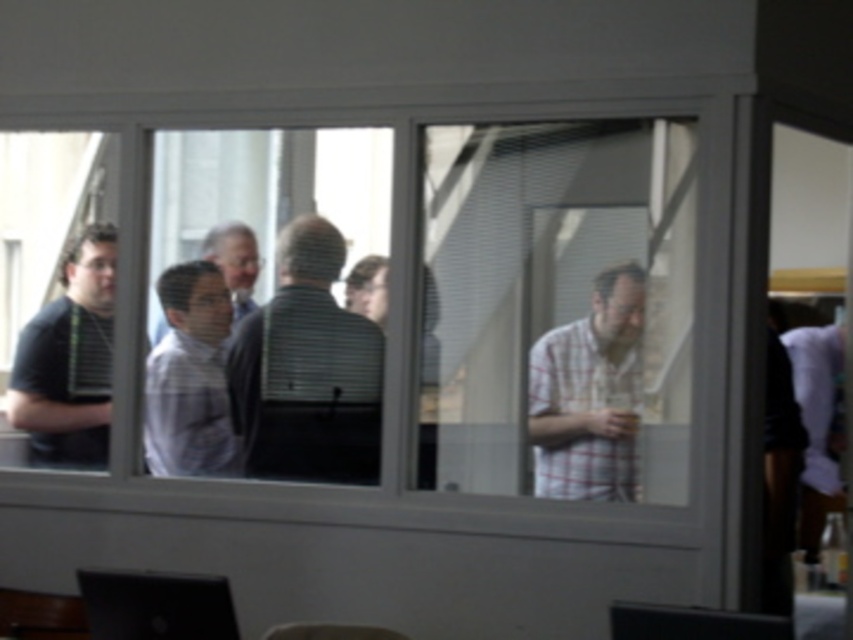
Does striped shirt at center have a lesser height compared to black glossy monitor at lower center?

Incorrect, striped shirt at center's height does not fall short of black glossy monitor at lower center's.

Measure the distance between point (367, 374) and camera.

The distance of point (367, 374) from camera is 4.48 meters.

At what (x,y) coordinates should I click in order to perform the action: click on striped shirt at center. Please return your answer as a coordinate pair (x, y). Image resolution: width=853 pixels, height=640 pixels. Looking at the image, I should click on (306, 369).

Can you confirm if transparent glass window at center is positioned to the left of plaid fabric shirt at right?

Correct, you'll find transparent glass window at center to the left of plaid fabric shirt at right.

Does transparent glass window at center have a larger size compared to plaid fabric shirt at right?

Yes.

Which is behind, point (399, 310) or point (560, 484)?

The point (399, 310) is more distant.

Locate an element on the screen. This screenshot has height=640, width=853. transparent glass window at center is located at coordinates (445, 301).

Based on the photo, who is positioned more to the left, matte white shirt at center or black glossy monitor at lower center?

From the viewer's perspective, matte white shirt at center appears more on the left side.

Who is more forward, (204, 291) or (645, 618)?

Point (645, 618) is more forward.

This screenshot has width=853, height=640. In order to click on matte white shirt at center in this screenshot , I will do `click(190, 378)`.